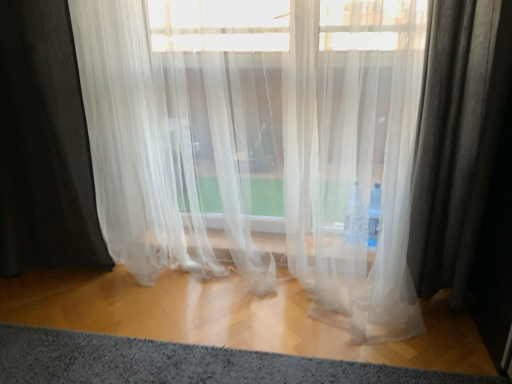
Find the location of `vacant space behind gray soft rug at lower center`. vacant space behind gray soft rug at lower center is located at coordinates (212, 307).